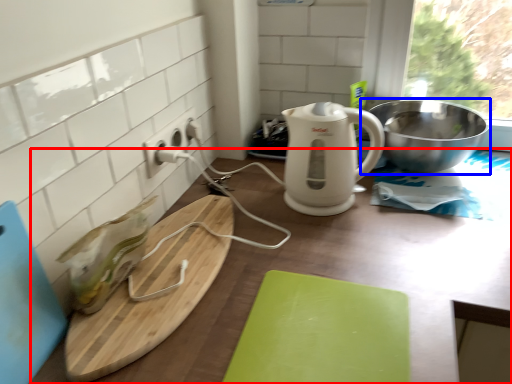
Question: Which object is further to the camera taking this photo, counter (highlighted by a red box) or bowl (highlighted by a blue box)?

Choices:
 (A) counter
 (B) bowl

Answer: (B)